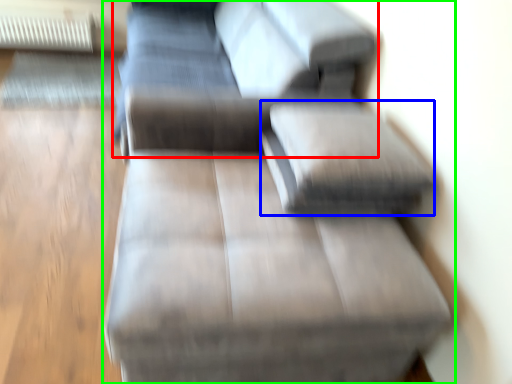
Question: Which is farther away from couch (highlighted by a red box)? pillow (highlighted by a blue box) or studio couch (highlighted by a green box)?

Choices:
 (A) pillow
 (B) studio couch

Answer: (A)